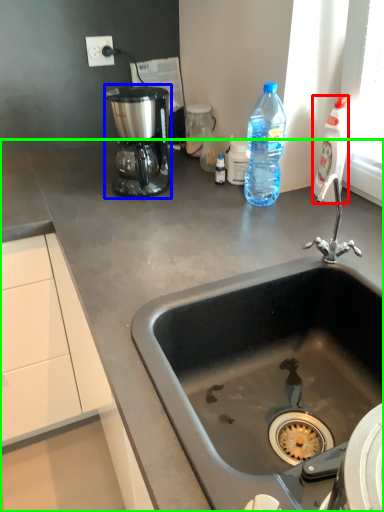
Question: Based on their relative distances, which object is nearer to bottle (highlighted by a red box)? Choose from coffee maker (highlighted by a blue box) and countertop (highlighted by a green box).

Choices:
 (A) coffee maker
 (B) countertop

Answer: (B)